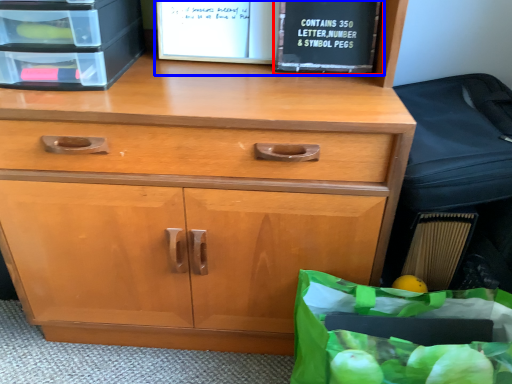
Question: Which object appears closest to the camera in this image, paperback book (highlighted by a red box) or book (highlighted by a blue box)?

Choices:
 (A) paperback book
 (B) book

Answer: (A)